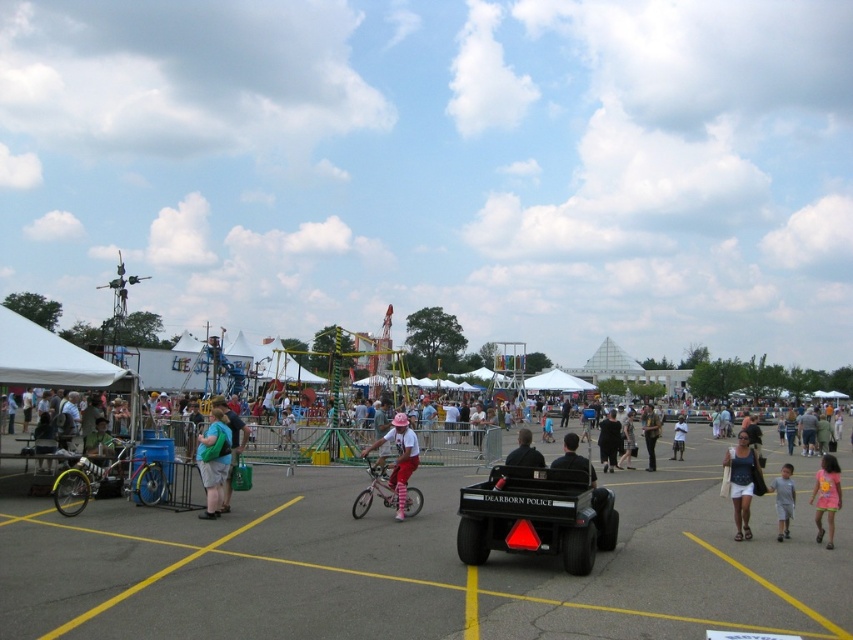
Question: Where is green fabric backpack at center located in relation to white cotton tank top at center in the image?

Choices:
 (A) left
 (B) right

Answer: (A)

Question: Where is white cotton tank top at center located in relation to dark blue shirt at center in the image?

Choices:
 (A) left
 (B) right

Answer: (B)

Question: Estimate the real-world distances between objects in this image. Which object is closer to the white cotton tank top at center?

Choices:
 (A) pink fabric shorts at center
 (B) gray fabric shirt at lower right
 (C) matte pink helmet at center

Answer: (B)

Question: Which object is closer to the camera taking this photo?

Choices:
 (A) silver metallic bicycle at left
 (B) black matte utility vehicle at center

Answer: (B)

Question: Considering the relative positions of pink fabric pants at center and green fabric backpack at center in the image provided, where is pink fabric pants at center located with respect to green fabric backpack at center?

Choices:
 (A) above
 (B) below

Answer: (B)

Question: Which point is farther to the camera?

Choices:
 (A) (616, 451)
 (B) (680, 426)
 (C) (216, 410)

Answer: (B)